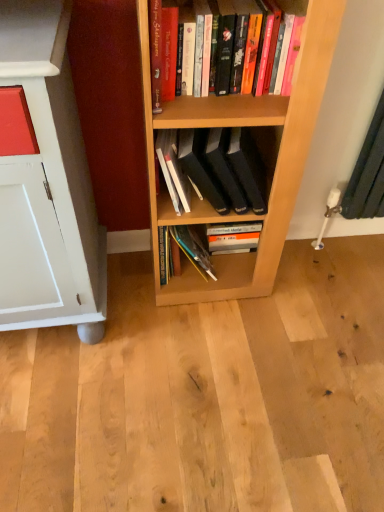
Question: Considering the relative positions of black matte book at center, acting as the 2th book starting from the top, and hardcover books at upper center, the second book from the bottom, in the image provided, is black matte book at center, acting as the 2th book starting from the top, to the left of hardcover books at upper center, the second book from the bottom, from the viewer's perspective?

Choices:
 (A) yes
 (B) no

Answer: (A)

Question: From the image's perspective, does black matte book at center, the 1th book when ordered from bottom to top, appear higher than hardcover books at upper center, the first book when ordered from top to bottom?

Choices:
 (A) no
 (B) yes

Answer: (A)

Question: Is black matte book at center, the 1th book when ordered from bottom to top, completely or partially outside of hardcover books at upper center, the second book from the bottom?

Choices:
 (A) yes
 (B) no

Answer: (A)

Question: From a real-world perspective, is black matte book at center, the 1th book when ordered from bottom to top, beneath hardcover books at upper center, the second book from the bottom?

Choices:
 (A) yes
 (B) no

Answer: (A)

Question: Does black matte book at center, acting as the 2th book starting from the top, come behind hardcover books at upper center, the first book when ordered from top to bottom?

Choices:
 (A) yes
 (B) no

Answer: (A)

Question: Is black matte book at center, acting as the 2th book starting from the top, wider than hardcover books at upper center, the first book when ordered from top to bottom?

Choices:
 (A) yes
 (B) no

Answer: (A)

Question: Is hardcover books at upper center, the second book from the bottom, taller than black matte book at center, the 1th book when ordered from bottom to top?

Choices:
 (A) yes
 (B) no

Answer: (B)

Question: Is hardcover books at upper center, the second book from the bottom, not close to black matte book at center, acting as the 2th book starting from the top?

Choices:
 (A) yes
 (B) no

Answer: (B)

Question: Is hardcover books at upper center, the first book when ordered from top to bottom, smaller than black matte book at center, the 1th book when ordered from bottom to top?

Choices:
 (A) no
 (B) yes

Answer: (B)

Question: From the image's perspective, is hardcover books at upper center, the second book from the bottom, under black matte book at center, the 1th book when ordered from bottom to top?

Choices:
 (A) no
 (B) yes

Answer: (A)

Question: Is hardcover books at upper center, the first book when ordered from top to bottom, not inside black matte book at center, the 1th book when ordered from bottom to top?

Choices:
 (A) no
 (B) yes

Answer: (B)

Question: Does hardcover books at upper center, the second book from the bottom, lie behind black matte book at center, acting as the 2th book starting from the top?

Choices:
 (A) yes
 (B) no

Answer: (B)

Question: Considering their positions, is black matte book at center, the 1th book when ordered from bottom to top, located in front of or behind hardcover books at upper center, the second book from the bottom?

Choices:
 (A) behind
 (B) front

Answer: (A)